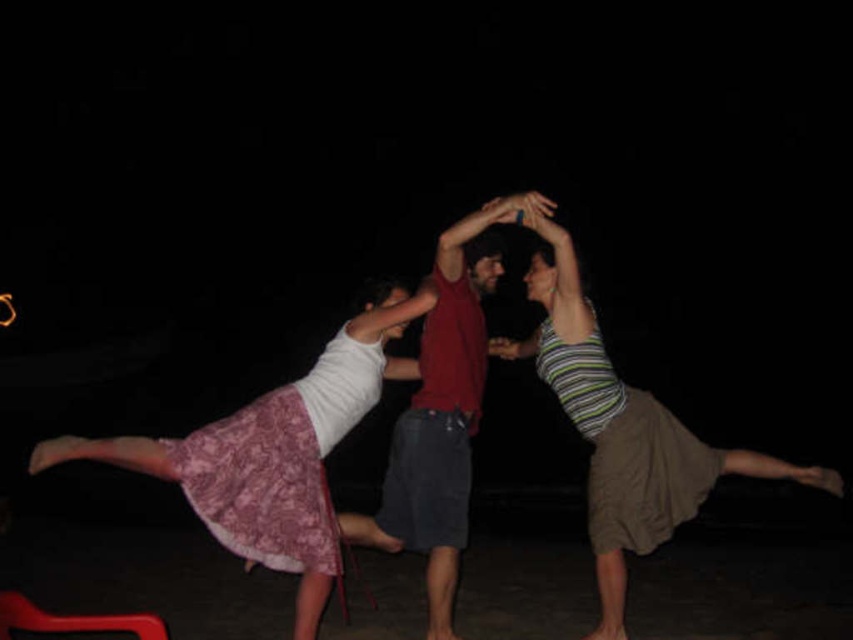
Question: Does matte pink lace skirt at left appear on the right side of striped cotton tank top at center?

Choices:
 (A) no
 (B) yes

Answer: (A)

Question: Is striped cotton tank top at center to the right of matte red shirt at center from the viewer's perspective?

Choices:
 (A) no
 (B) yes

Answer: (B)

Question: Estimate the real-world distances between objects in this image. Which object is closer to the rubberized red chair at lower left?

Choices:
 (A) matte red shirt at center
 (B) matte pink lace skirt at left

Answer: (B)

Question: Which point is closer to the camera?

Choices:
 (A) (622, 532)
 (B) (357, 518)
 (C) (143, 621)

Answer: (C)

Question: Which object is positioned closest to the matte red shirt at center?

Choices:
 (A) striped cotton tank top at center
 (B) matte pink lace skirt at left

Answer: (B)

Question: Considering the relative positions of striped cotton tank top at center and matte red shirt at center in the image provided, where is striped cotton tank top at center located with respect to matte red shirt at center?

Choices:
 (A) right
 (B) left

Answer: (A)